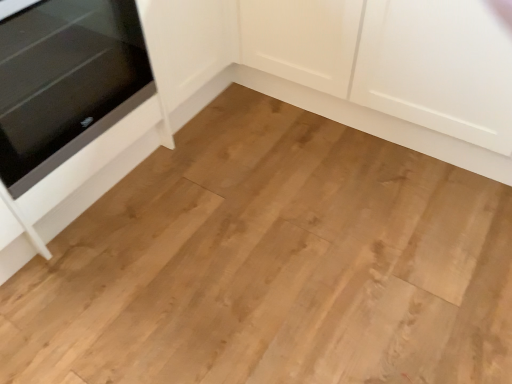
Question: From the image's perspective, is black glass oven at left below white matte cabinet at center?

Choices:
 (A) yes
 (B) no

Answer: (A)

Question: Can you confirm if black glass oven at left is wider than white matte cabinet at center?

Choices:
 (A) no
 (B) yes

Answer: (B)

Question: Is black glass oven at left turned away from white matte cabinet at center?

Choices:
 (A) no
 (B) yes

Answer: (A)

Question: Can you confirm if black glass oven at left is thinner than white matte cabinet at center?

Choices:
 (A) yes
 (B) no

Answer: (B)

Question: From a real-world perspective, is black glass oven at left positioned under white matte cabinet at center based on gravity?

Choices:
 (A) no
 (B) yes

Answer: (A)

Question: Does black glass oven at left have a smaller size compared to white matte cabinet at center?

Choices:
 (A) yes
 (B) no

Answer: (A)

Question: Can we say white matte cabinet at center lies outside black glass oven at left?

Choices:
 (A) no
 (B) yes

Answer: (B)

Question: From the image's perspective, does white matte cabinet at center appear higher than black glass oven at left?

Choices:
 (A) yes
 (B) no

Answer: (A)

Question: Is the position of white matte cabinet at center more distant than that of black glass oven at left?

Choices:
 (A) no
 (B) yes

Answer: (B)

Question: Is white matte cabinet at center to the right of black glass oven at left from the viewer's perspective?

Choices:
 (A) no
 (B) yes

Answer: (B)

Question: Is the depth of white matte cabinet at center less than that of black glass oven at left?

Choices:
 (A) yes
 (B) no

Answer: (B)

Question: Considering the relative sizes of white matte cabinet at center and black glass oven at left in the image provided, is white matte cabinet at center thinner than black glass oven at left?

Choices:
 (A) no
 (B) yes

Answer: (B)

Question: Is white matte cabinet at center wider or thinner than black glass oven at left?

Choices:
 (A) thin
 (B) wide

Answer: (A)